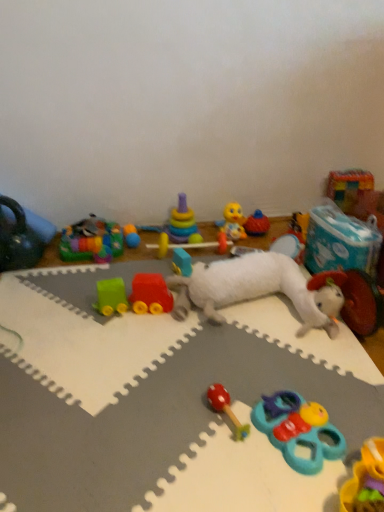
This screenshot has height=512, width=384. I want to click on vacant point to the right of smooth red wooden rattle at center, which ranks as the 7th toy in left-to-right order, so pos(302,400).